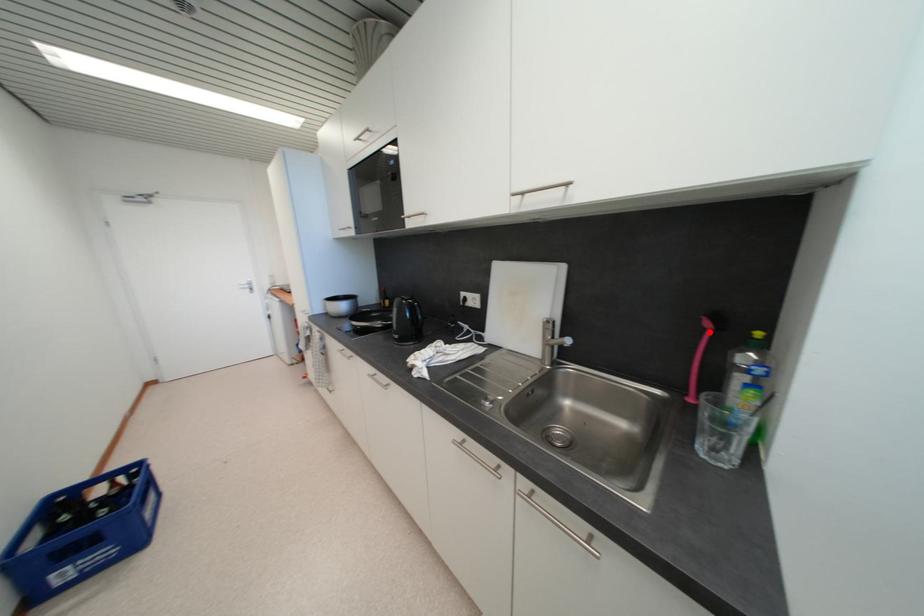
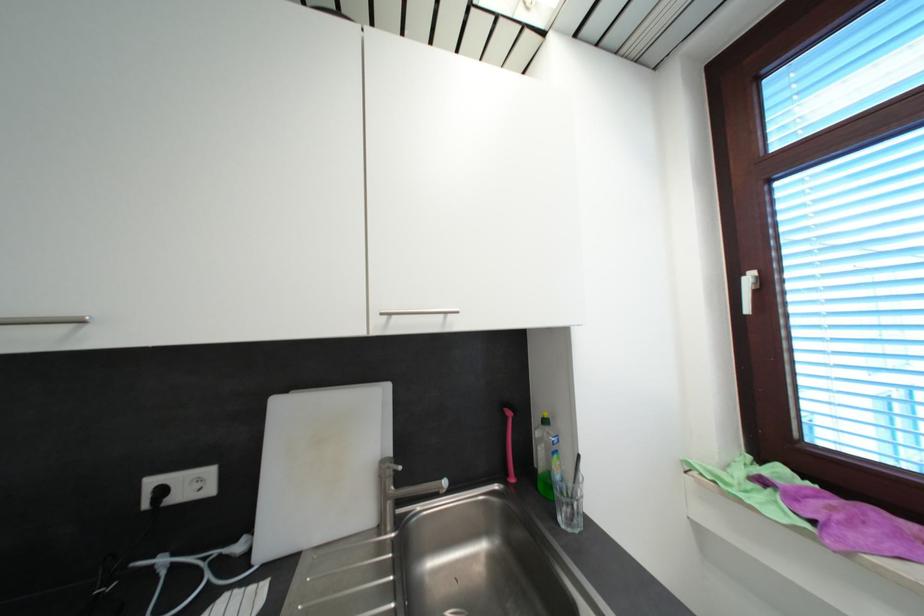
Find the pixel in the second image that matches the highlighted location in the first image.

(512, 419)